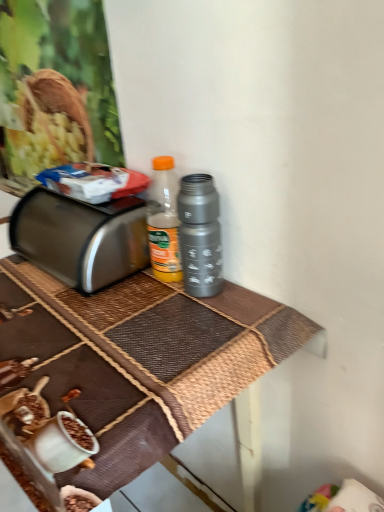
What do you see at coordinates (138, 361) in the screenshot?
I see `metallic brown table at center` at bounding box center [138, 361].

What are the coordinates of `satin silver toaster at left` in the screenshot? It's located at (81, 237).

Does metallic brown table at center have a lesser height compared to satin silver toaster at left?

Incorrect, the height of metallic brown table at center does not fall short of that of satin silver toaster at left.

From the picture: Can you tell me how much metallic brown table at center and satin silver toaster at left differ in facing direction?

There is a 0.000427-degree angle between the facing directions of metallic brown table at center and satin silver toaster at left.

From a real-world perspective, relative to satin silver toaster at left, is metallic brown table at center vertically above or below?

metallic brown table at center is below satin silver toaster at left.

Is metallic brown table at center turned away from satin silver toaster at left?

No, metallic brown table at center is not facing away from satin silver toaster at left.

In the image, is metallic brown table at center positioned in front of or behind metallic gray thermos at center?

In the image, metallic brown table at center appears in front of metallic gray thermos at center.

Is metallic gray thermos at center a part of metallic brown table at center?

No, metallic gray thermos at center is not a part of metallic brown table at center.

Considering the relative sizes of metallic brown table at center and metallic gray thermos at center in the image provided, is metallic brown table at center taller than metallic gray thermos at center?

Yes.

How distant is metallic brown table at center from metallic gray thermos at center?

7.67 inches.

Is point (48, 211) positioned before point (201, 198)?

No, it is behind (201, 198).

Looking at this image, from a real-world perspective, is satin silver toaster at left positioned above or below metallic gray thermos at center?

In terms of real-world spatial position, satin silver toaster at left is below metallic gray thermos at center.

Could you tell me if satin silver toaster at left is facing metallic gray thermos at center?

No, satin silver toaster at left is not turned towards metallic gray thermos at center.

Where is `bottle located in front of the satin silver toaster at left`? The width and height of the screenshot is (384, 512). bottle located in front of the satin silver toaster at left is located at coordinates tap(200, 234).

From a real-world perspective, which object rests below the other?

metallic brown table at center.

I want to click on bottle above the metallic brown table at center (from the image's perspective), so click(200, 234).

Does point (201, 179) come behind point (59, 364)?

Yes, point (201, 179) is behind point (59, 364).

From the picture: Can you confirm if metallic gray thermos at center is thinner than metallic brown table at center?

Correct, the width of metallic gray thermos at center is less than that of metallic brown table at center.

Is satin silver toaster at left not within metallic brown table at center?

satin silver toaster at left is positioned outside metallic brown table at center.

Considering the positions of points (15, 240) and (80, 342), is point (15, 240) farther from camera compared to point (80, 342)?

Yes, it is behind point (80, 342).

Can you see metallic gray thermos at center touching satin silver toaster at left?

No.

Does point (220, 246) come in front of point (54, 221)?

Yes, it is in front of point (54, 221).

Is metallic gray thermos at center located outside satin silver toaster at left?

Absolutely, metallic gray thermos at center is external to satin silver toaster at left.

Consider the image. Which of these two, metallic gray thermos at center or satin silver toaster at left, stands shorter?

satin silver toaster at left is shorter.

This screenshot has height=512, width=384. In order to click on toaster above the metallic brown table at center (from a real-world perspective) in this screenshot , I will do `click(81, 237)`.

I want to click on bottle to the right of metallic brown table at center, so pyautogui.click(x=200, y=234).

When comparing their distances from metallic brown table at center, does satin silver toaster at left or metallic gray thermos at center seem closer?

satin silver toaster at left lies closer to metallic brown table at center than the other object.

Looking at the image, which one is located closer to metallic brown table at center, metallic gray thermos at center or satin silver toaster at left?

satin silver toaster at left.

Based on their spatial positions, is metallic brown table at center or metallic gray thermos at center further from satin silver toaster at left?

Based on the image, metallic gray thermos at center appears to be further to satin silver toaster at left.

Based on the photo, when comparing their distances from metallic gray thermos at center, does metallic brown table at center or satin silver toaster at left seem further?

satin silver toaster at left is positioned further to the anchor metallic gray thermos at center.

Based on their spatial positions, is metallic gray thermos at center or metallic brown table at center closer to satin silver toaster at left?

metallic brown table at center.

Estimate the real-world distances between objects in this image. Which object is closer to metallic gray thermos at center, satin silver toaster at left or metallic brown table at center?

metallic brown table at center is positioned closer to the anchor metallic gray thermos at center.

You are a GUI agent. You are given a task and a screenshot of the screen. Output one action in this format:
    pyautogui.click(x=<x>, y=<y>)
    Task: Click on the bottle that lies between satin silver toaster at left and metallic brown table at center from top to bottom
    
    Given the screenshot: What is the action you would take?
    pyautogui.click(x=200, y=234)